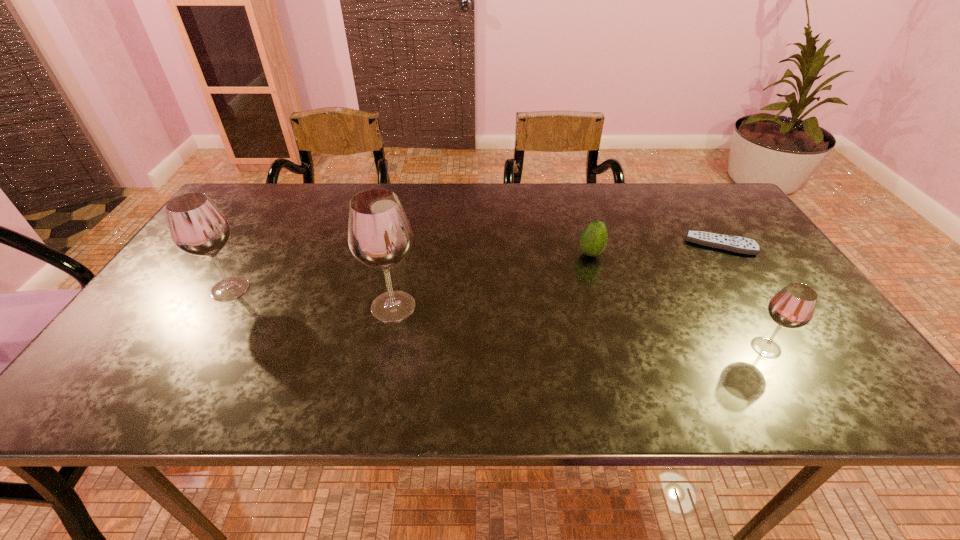
The width and height of the screenshot is (960, 540). Find the location of `spot to insert another wineglass for uniform distribution`. spot to insert another wineglass for uniform distribution is located at coordinates (571, 326).